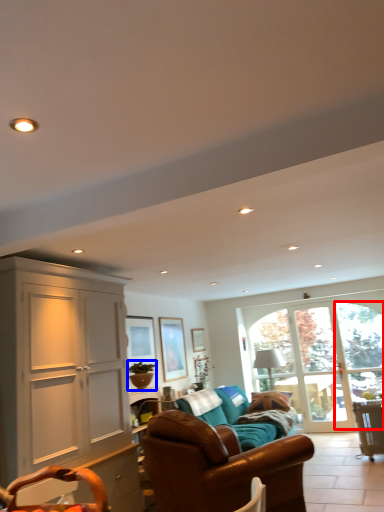
Question: Which point is closer to the camera, window (highlighted by a red box) or houseplant (highlighted by a blue box)?

Choices:
 (A) window
 (B) houseplant

Answer: (B)